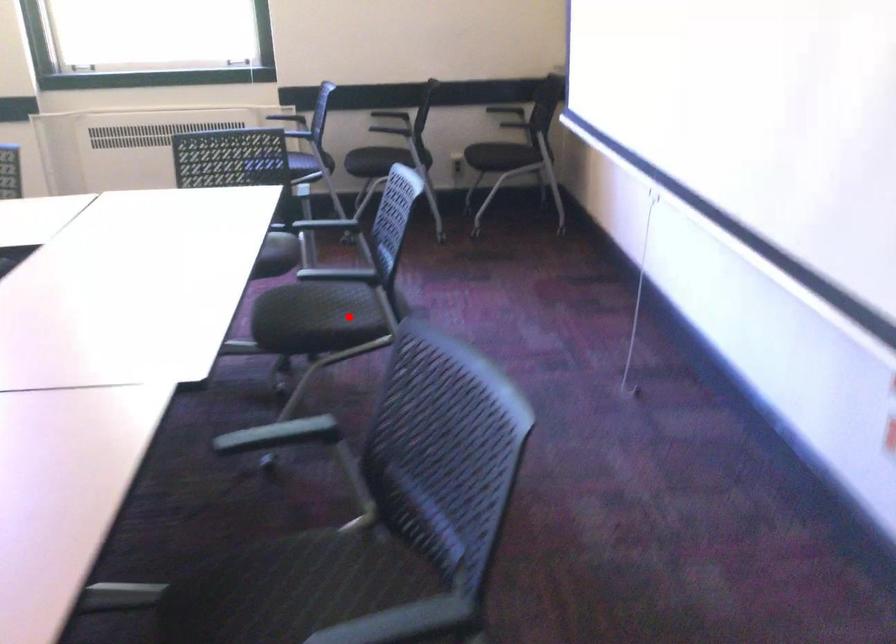
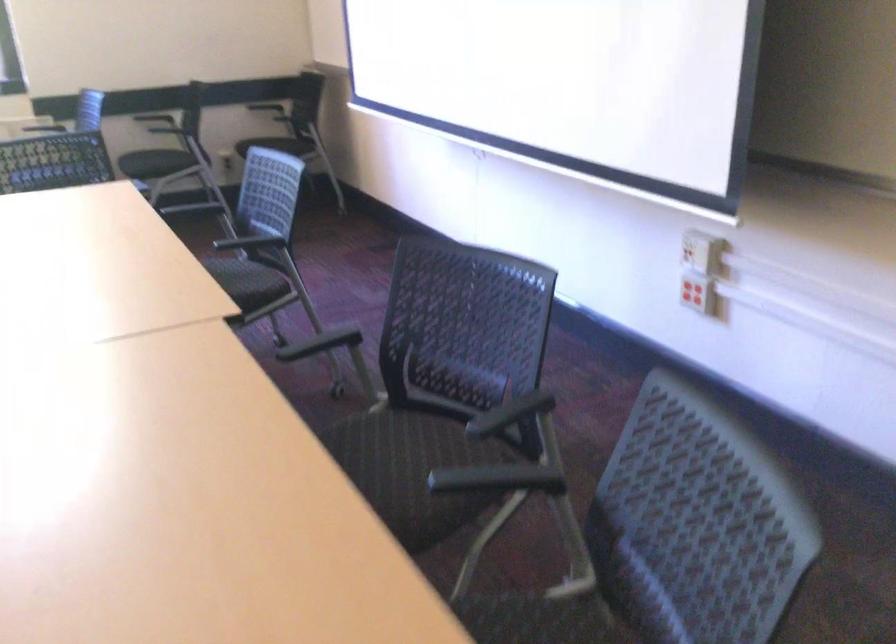
Locate, in the second image, the point that corresponds to the highlighted location in the first image.

(245, 281)